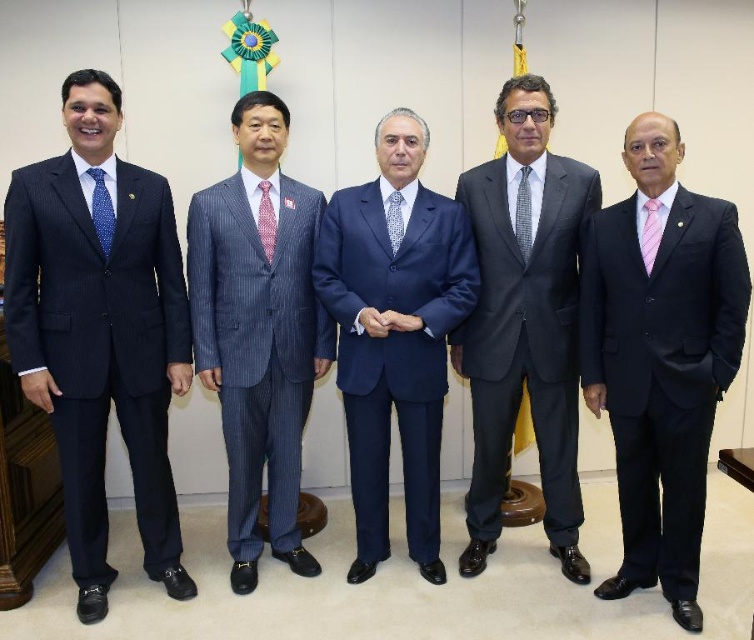
Identify the location of pink silk suit at right. The image size is (754, 640). (661, 358).

In the scene shown: Is pink silk suit at right to the left of pink silk tie at right from the viewer's perspective?

No, pink silk suit at right is not to the left of pink silk tie at right.

Is point (694, 316) positioned after point (653, 202)?

No, it is in front of (653, 202).

The image size is (754, 640). Identify the location of pink silk suit at right. pos(661,358).

Is blue satin suit at center bigger than dark gray suit at center?

Incorrect, blue satin suit at center is not larger than dark gray suit at center.

Which is below, blue satin suit at center or dark gray suit at center?

blue satin suit at center is below.

Who is more distant from viewer, (372,298) or (520,346)?

Positioned behind is point (520,346).

Find the location of `blue satin suit at center`. blue satin suit at center is located at coordinates (394, 336).

Is blue striped suit at center bigger than pink patterned tie at center?

Correct, blue striped suit at center is larger in size than pink patterned tie at center.

This screenshot has width=754, height=640. Identify the location of blue striped suit at center. (259, 332).